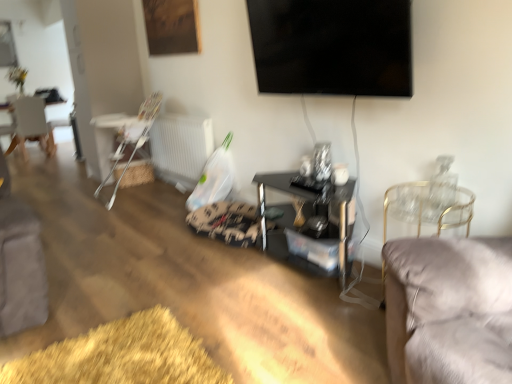
Image resolution: width=512 pixels, height=384 pixels. What do you see at coordinates (31, 126) in the screenshot?
I see `white wooden chair at left, the 1th chair viewed from the left` at bounding box center [31, 126].

This screenshot has height=384, width=512. Describe the element at coordinates (310, 225) in the screenshot. I see `metallic black coffee table at center` at that location.

From the picture: Measure the distance between point (281, 80) and camera.

They are 2.55 meters apart.

Locate an element on the screen. The width and height of the screenshot is (512, 384). white plastic highchair at left, the 2th chair viewed from the front is located at coordinates (133, 139).

Image resolution: width=512 pixels, height=384 pixels. What do you see at coordinates (133, 139) in the screenshot? I see `white plastic highchair at left, which appears as the second chair when viewed from the right` at bounding box center [133, 139].

The height and width of the screenshot is (384, 512). Find the location of `white wooden chair at left, the 1th chair viewed from the left`. white wooden chair at left, the 1th chair viewed from the left is located at coordinates (31, 126).

Considering the positions of point (430, 218) and point (340, 281), is point (430, 218) closer or farther from the camera than point (340, 281)?

Clearly, point (430, 218) is closer to the camera than point (340, 281).

Is velvet grey chair at right, marked as the 3th chair in a left-to-right arrangement, shorter than metallic black coffee table at center?

Incorrect, the height of velvet grey chair at right, marked as the 3th chair in a left-to-right arrangement, does not fall short of that of metallic black coffee table at center.

Is velvet grey chair at right, the first chair from the front, facing away from metallic black coffee table at center?

That's not correct — velvet grey chair at right, the first chair from the front, is not looking away from metallic black coffee table at center.

How many degrees apart are the facing directions of white plastic radiator at lower center and white plastic highchair at left, the 2th chair viewed from the front?

The angular difference between white plastic radiator at lower center and white plastic highchair at left, the 2th chair viewed from the front, is 0.000198 degrees.

Are white plastic radiator at lower center and white plastic highchair at left, which is the second chair from back to front, beside each other?

white plastic radiator at lower center and white plastic highchair at left, which is the second chair from back to front, are not in contact.

Is point (199, 167) less distant than point (116, 165)?

Yes, it is in front of point (116, 165).

Can you confirm if white plastic radiator at lower center is shorter than white plastic highchair at left, which is the 2th chair in left-to-right order?

Yes, white plastic radiator at lower center is shorter than white plastic highchair at left, which is the 2th chair in left-to-right order.

Considering the relative sizes of velvet grey chair at right, which is counted as the third chair, starting from the back, and black glossy tv at upper center in the image provided, is velvet grey chair at right, which is counted as the third chair, starting from the back, bigger than black glossy tv at upper center?

Incorrect, velvet grey chair at right, which is counted as the third chair, starting from the back, is not larger than black glossy tv at upper center.

Is velvet grey chair at right, which is counted as the third chair, starting from the back, facing towards black glossy tv at upper center?

No.

Which object is thinner, velvet grey chair at right, which is counted as the third chair, starting from the back, or black glossy tv at upper center?

black glossy tv at upper center is thinner.

Is white plastic radiator at lower center beside velvet grey chair at right, which is counted as the third chair, starting from the back?

No, white plastic radiator at lower center is not in contact with velvet grey chair at right, which is counted as the third chair, starting from the back.

Is white plastic radiator at lower center aimed at velvet grey chair at right, which is counted as the third chair, starting from the back?

No, white plastic radiator at lower center does not turn towards velvet grey chair at right, which is counted as the third chair, starting from the back.

From the picture: Between white plastic radiator at lower center and velvet grey chair at right, which is counted as the third chair, starting from the back, which one appears on the left side from the viewer's perspective?

white plastic radiator at lower center.

The height and width of the screenshot is (384, 512). Identify the location of radiator above the velvet grey chair at right, which ranks as the first chair in right-to-left order (from a real-world perspective). (181, 147).

Is point (142, 104) in front of point (268, 63)?

No, (142, 104) is further to viewer.

Is white plastic highchair at left, which appears as the second chair when viewed from the right, turned away from black glossy tv at upper center?

white plastic highchair at left, which appears as the second chair when viewed from the right, is not turned away from black glossy tv at upper center.

Does white plastic highchair at left, which is the 2th chair in left-to-right order, have a smaller size compared to black glossy tv at upper center?

No, white plastic highchair at left, which is the 2th chair in left-to-right order, is not smaller than black glossy tv at upper center.

Is white plastic highchair at left, the 2th chair viewed from the front, not near black glossy tv at upper center?

That's right, there is a large distance between white plastic highchair at left, the 2th chair viewed from the front, and black glossy tv at upper center.

Is white wooden chair at left, the 1th chair in the back-to-front sequence, positioned before white plastic radiator at lower center?

No.

From a real-world perspective, does white wooden chair at left, the 3th chair in the front-to-back sequence, stand above white plastic radiator at lower center?

Yes.

From the image's perspective, is white wooden chair at left, the 1th chair viewed from the left, located beneath white plastic radiator at lower center?

No, from the image's perspective, white wooden chair at left, the 1th chair viewed from the left, is not below white plastic radiator at lower center.

In the image, is velvet grey chair at right, the first chair from the front, positioned in front of or behind white plastic highchair at left, which is the second chair from back to front?

In the image, velvet grey chair at right, the first chair from the front, appears in front of white plastic highchair at left, which is the second chair from back to front.

Can you confirm if velvet grey chair at right, the first chair from the front, is positioned to the left of white plastic highchair at left, which is the 2th chair in left-to-right order?

No.

Which is less distant, (x=461, y=213) or (x=157, y=112)?

Clearly, point (x=461, y=213) is closer to the camera than point (x=157, y=112).

From the image's perspective, which object appears higher, velvet grey chair at right, which ranks as the first chair in right-to-left order, or white plastic highchair at left, the 2th chair viewed from the front?

white plastic highchair at left, the 2th chair viewed from the front, appears higher in the image.

At what (x,y) coordinates should I click in order to perform the action: click on chair below the metallic black coffee table at center (from the image's perspective). Please return your answer as a coordinate pair (x, y). This screenshot has width=512, height=384. Looking at the image, I should click on (426, 207).

Find the location of a particular element. radiator to the right of white plastic highchair at left, which appears as the second chair when viewed from the right is located at coordinates (181, 147).

Estimate the real-world distances between objects in this image. Which object is closer to white plastic highchair at left, the 2th chair viewed from the front, white plastic radiator at lower center or metallic black coffee table at center?

The object closer to white plastic highchair at left, the 2th chair viewed from the front, is white plastic radiator at lower center.

Looking at this image, from the image, which object appears to be nearer to metallic black coffee table at center, white plastic radiator at lower center or white plastic highchair at left, the 2th chair viewed from the front?

Based on the image, white plastic radiator at lower center appears to be nearer to metallic black coffee table at center.

Estimate the real-world distances between objects in this image. Which object is further from velvet grey chair at right, which ranks as the first chair in right-to-left order, black glossy tv at upper center or white wooden chair at left, which is counted as the 3th chair, starting from the right?

Among the two, white wooden chair at left, which is counted as the 3th chair, starting from the right, is located further to velvet grey chair at right, which ranks as the first chair in right-to-left order.

Considering their positions, is metallic black coffee table at center positioned further to velvet grey chair at right, which ranks as the first chair in right-to-left order, than black glossy tv at upper center?

black glossy tv at upper center is positioned further to the anchor velvet grey chair at right, which ranks as the first chair in right-to-left order.

Looking at the image, which one is located further to black glossy tv at upper center, metallic black coffee table at center or velvet grey chair at right, which is counted as the third chair, starting from the back?

metallic black coffee table at center.

Estimate the real-world distances between objects in this image. Which object is closer to velvet grey chair at right, the first chair from the front, white wooden chair at left, the 1th chair in the back-to-front sequence, or white plastic radiator at lower center?

Based on the image, white plastic radiator at lower center appears to be nearer to velvet grey chair at right, the first chair from the front.

Looking at the image, which one is located closer to white plastic highchair at left, which is the second chair from back to front, white wooden chair at left, which is counted as the 3th chair, starting from the right, or black glossy tv at upper center?

The object closer to white plastic highchair at left, which is the second chair from back to front, is black glossy tv at upper center.

Estimate the real-world distances between objects in this image. Which object is further from white plastic radiator at lower center, black glossy tv at upper center or metallic black coffee table at center?

black glossy tv at upper center.

The width and height of the screenshot is (512, 384). Identify the location of radiator between metallic black coffee table at center and white wooden chair at left, the 1th chair in the back-to-front sequence, from front to back. (181, 147).

Identify the location of table between white plastic highchair at left, the 2th chair viewed from the front, and velvet grey chair at right, which ranks as the first chair in right-to-left order, in the horizontal direction. (310, 225).

Identify the location of chair between velvet grey chair at right, the first chair from the front, and white plastic radiator at lower center, along the z-axis. (133, 139).

This screenshot has height=384, width=512. I want to click on chair located between white wooden chair at left, the 3th chair in the front-to-back sequence, and white plastic radiator at lower center in the left-right direction, so click(133, 139).